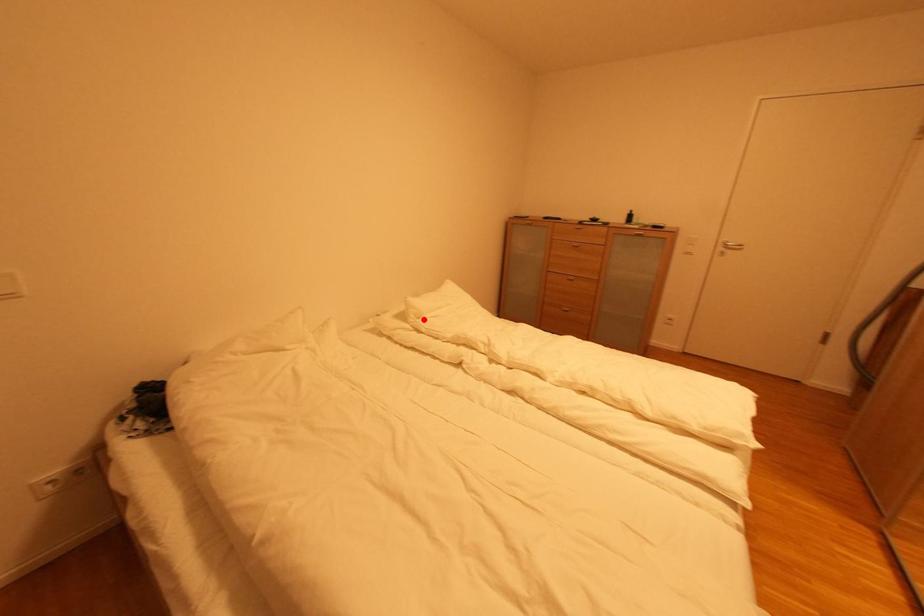
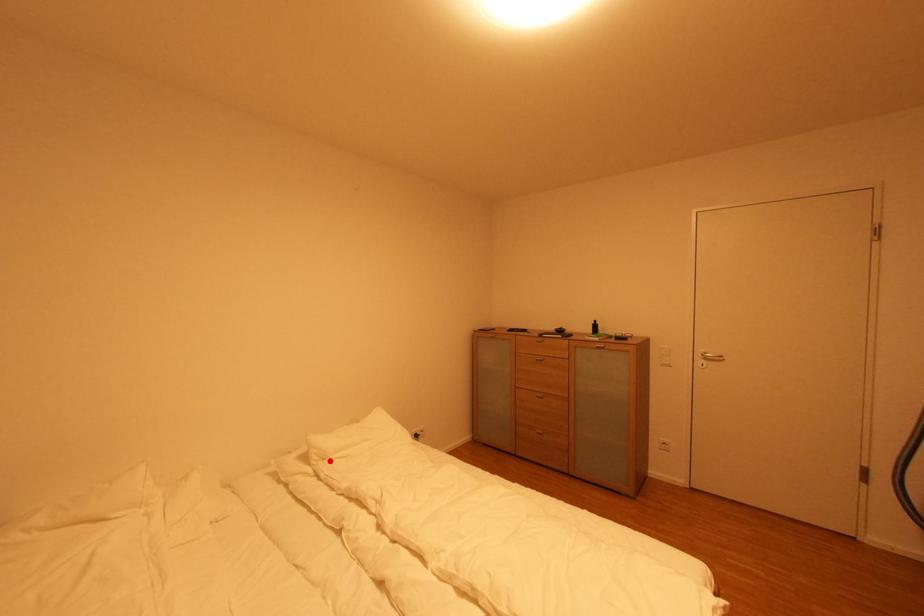
I am providing you with two images of the same scene from different viewpoints. A red point is marked on the first image and another point is marked on the second image. Is the marked point in image1 the same physical position as the marked point in image2?

Yes